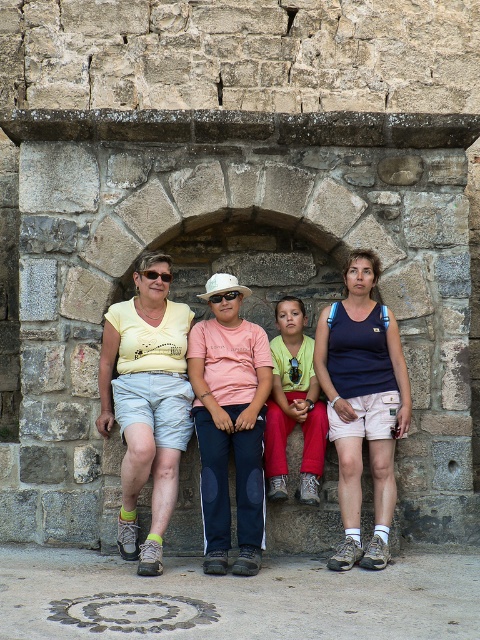
Is light yellow cotton shirt at center wider than matte yellow goggles at center?

Yes, light yellow cotton shirt at center is wider than matte yellow goggles at center.

Is point (105, 435) farther from camera compared to point (169, 280)?

No, (105, 435) is closer to viewer.

Who is more forward, (149,369) or (156,276)?

Point (149,369) is in front.

The height and width of the screenshot is (640, 480). What are the coordinates of `light yellow cotton shirt at center` in the screenshot? It's located at (146, 403).

Does pink fabric shirt at center lie behind yellow-green t-shirt at center?

No, it is not.

Who is more forward, (x=215, y=337) or (x=312, y=346)?

Point (x=215, y=337)

Is point (264, 515) positioned behind point (288, 385)?

No, it is in front of (288, 385).

You are a GUI agent. You are given a task and a screenshot of the screen. Output one action in this format:
    pyautogui.click(x=<x>, y=<y>)
    Task: Click on the pink fabric shirt at center
    The width and height of the screenshot is (480, 640).
    Given the screenshot: What is the action you would take?
    pyautogui.click(x=229, y=424)

Can you confirm if navy blue tank top at center is positioned below transparent plastic goggles at center?

Correct, navy blue tank top at center is located below transparent plastic goggles at center.

Between point (387, 493) and point (230, 300), which one is positioned in front?

Point (387, 493) is more forward.

Identify the location of navy blue tank top at center. This screenshot has height=640, width=480. (362, 404).

Where is `navy blue tank top at center`? navy blue tank top at center is located at coordinates (362, 404).